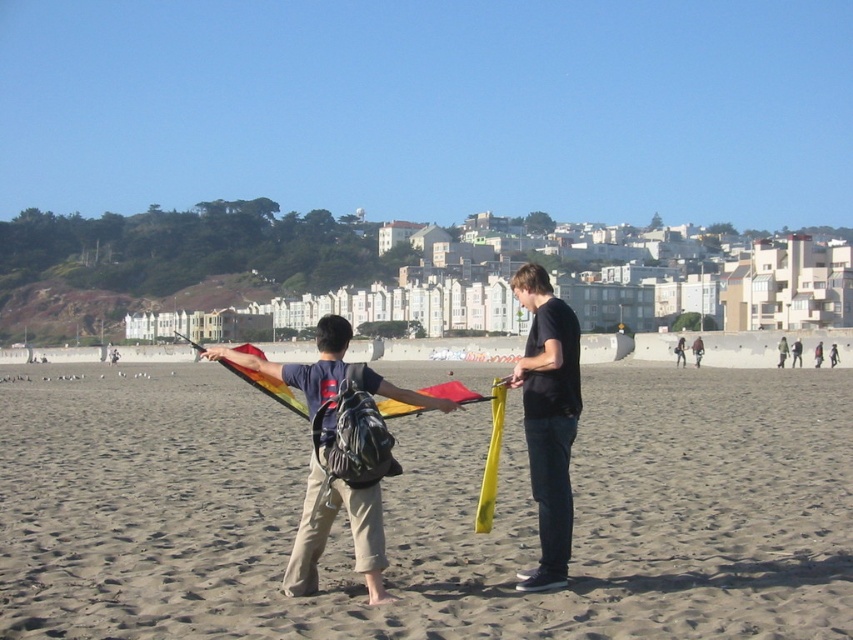
You are planning to set up a picnic blanket on the sandy beach at center. Considering the size of the area and the presence of the matte black shirt at center, will there be enough space for the blanket?

The sandy beach at center has a larger size compared to the matte black shirt at center, so there should be enough space to place the picnic blanket.

You are a photographer planning to take a wide shot of the sandy beach at center and the rainbow fabric kite at center. Based on their sizes in the image, which object should you focus on to ensure both are clearly visible in the frame?

The sandy beach at center occupies less space than the rainbow fabric kite at center, so focusing on the rainbow fabric kite at center will help ensure both are clearly visible since it takes up more of the frame.